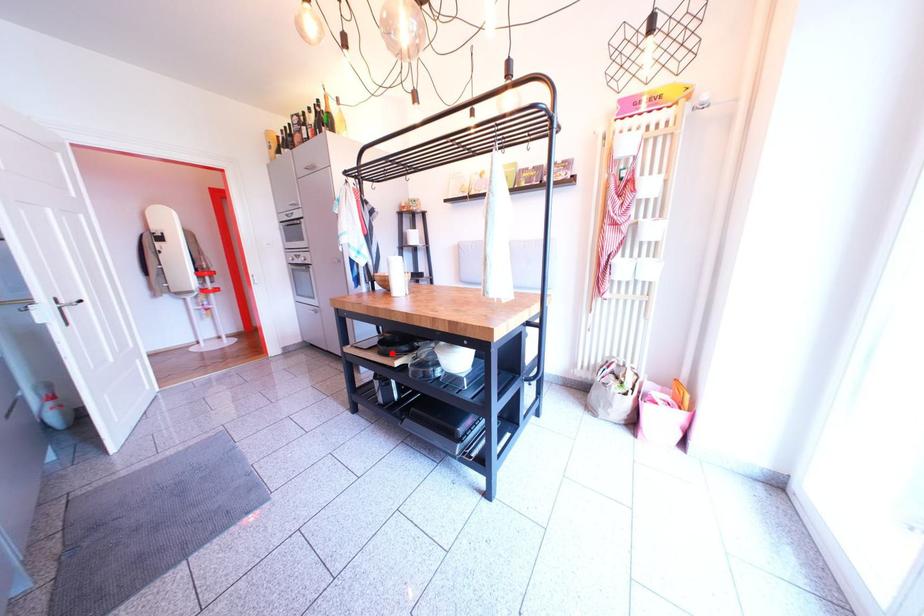
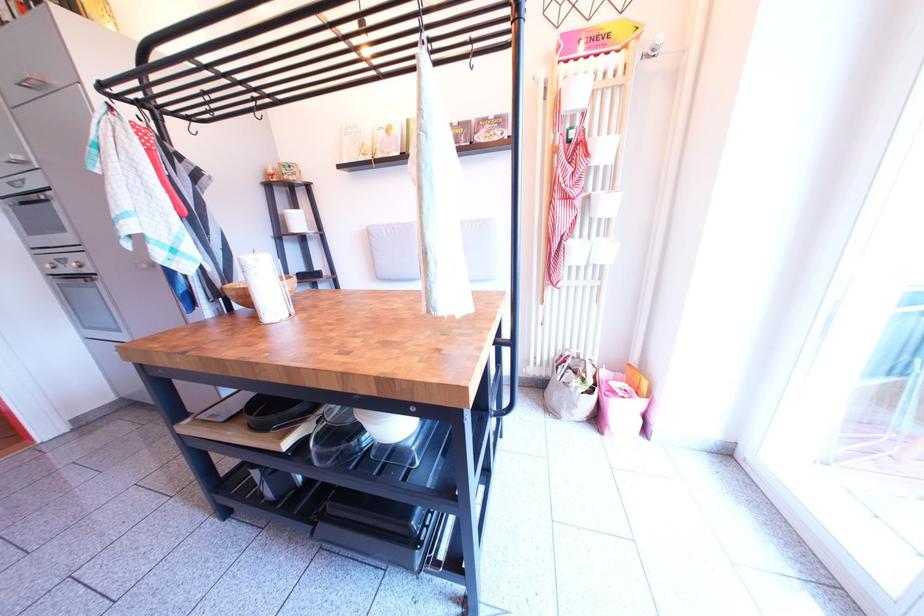
Where in the second image is the point corresponding to the highlighted location from the first image?

(263, 423)